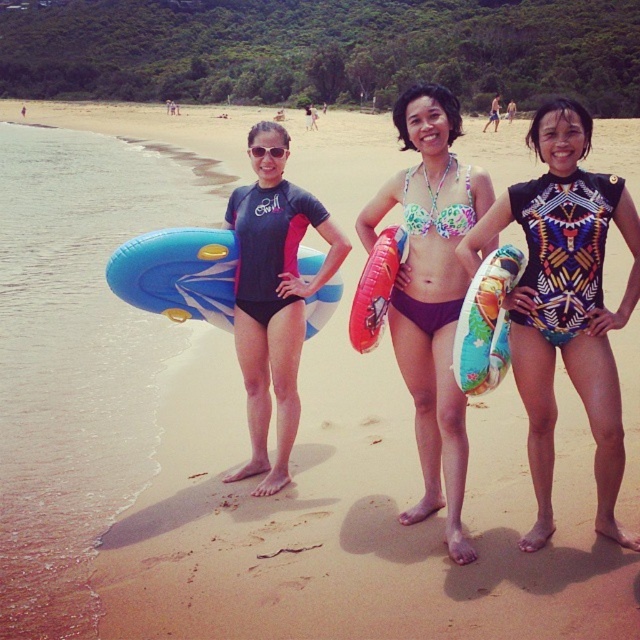
Which is more to the left, matte black wetsuit at center or blue inflatable ring at center?

blue inflatable ring at center is more to the left.

Can you confirm if matte black wetsuit at center is wider than blue inflatable ring at center?

No, matte black wetsuit at center is not wider than blue inflatable ring at center.

Which is in front, point (260, 246) or point (138, 244)?

Point (138, 244) is in front.

This screenshot has width=640, height=640. What are the coordinates of `matte black wetsuit at center` in the screenshot? It's located at (273, 296).

Who is more forward, (x=426, y=401) or (x=385, y=284)?

Point (x=385, y=284)

At what (x,y) coordinates should I click in order to perform the action: click on floral bikini at center. Please return your answer as a coordinate pair (x, y). Image resolution: width=640 pixels, height=640 pixels. Looking at the image, I should click on (432, 292).

I want to click on floral bikini at center, so click(432, 292).

Between floral bikini at center and matte black wetsuit at center, which one has more height?

matte black wetsuit at center is taller.

Does floral bikini at center have a lesser height compared to matte black wetsuit at center?

Yes.

Who is more distant from viewer, [419,269] or [284,445]?

Positioned behind is point [284,445].

Image resolution: width=640 pixels, height=640 pixels. What are the coordinates of `floral bikini at center` in the screenshot? It's located at pos(432,292).